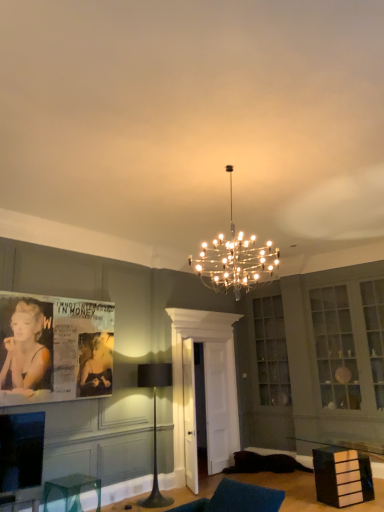
Question: From a real-world perspective, does black matte floor lamp at center, placed as the first lamp when sorted from bottom to top, sit lower than matte paper poster at left?

Choices:
 (A) no
 (B) yes

Answer: (B)

Question: Is black matte floor lamp at center, arranged as the 2th lamp when viewed from the top, completely or partially outside of matte paper poster at left?

Choices:
 (A) no
 (B) yes

Answer: (B)

Question: From the image's perspective, is black matte floor lamp at center, arranged as the 2th lamp when viewed from the top, over matte paper poster at left?

Choices:
 (A) no
 (B) yes

Answer: (A)

Question: Are black matte floor lamp at center, the 1th lamp in the back-to-front sequence, and matte paper poster at left making contact?

Choices:
 (A) no
 (B) yes

Answer: (A)

Question: Considering the relative positions of black matte floor lamp at center, which appears as the second lamp when viewed from the front, and matte paper poster at left in the image provided, is black matte floor lamp at center, which appears as the second lamp when viewed from the front, behind matte paper poster at left?

Choices:
 (A) no
 (B) yes

Answer: (B)

Question: Is black matte floor lamp at center, the 1th lamp in the back-to-front sequence, thinner than matte paper poster at left?

Choices:
 (A) no
 (B) yes

Answer: (A)

Question: Is clear glass chandelier at center, the second lamp viewed from the left, positioned behind matte paper poster at left?

Choices:
 (A) no
 (B) yes

Answer: (A)

Question: Is clear glass chandelier at center, which is the 1th lamp in top-to-bottom order, to the left of matte paper poster at left from the viewer's perspective?

Choices:
 (A) no
 (B) yes

Answer: (A)

Question: From the image's perspective, would you say clear glass chandelier at center, which is the 1th lamp in top-to-bottom order, is positioned over matte paper poster at left?

Choices:
 (A) no
 (B) yes

Answer: (B)

Question: From the image's perspective, does clear glass chandelier at center, the second lamp viewed from the left, appear lower than matte paper poster at left?

Choices:
 (A) no
 (B) yes

Answer: (A)

Question: Is clear glass chandelier at center, the second lamp viewed from the left, thinner than matte paper poster at left?

Choices:
 (A) yes
 (B) no

Answer: (B)

Question: Does clear glass chandelier at center, the first lamp when ordered from right to left, have a smaller size compared to matte paper poster at left?

Choices:
 (A) yes
 (B) no

Answer: (B)

Question: Can clear glass cube at lower left, which appears as the second furniture when viewed from the right, be found inside black matte floor lamp at center, the 1th lamp in the back-to-front sequence?

Choices:
 (A) no
 (B) yes

Answer: (A)